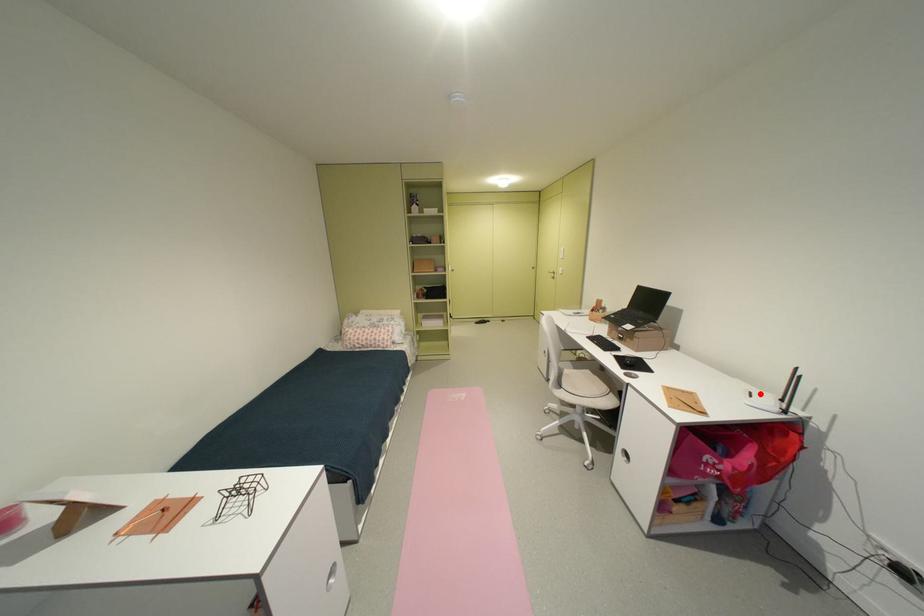
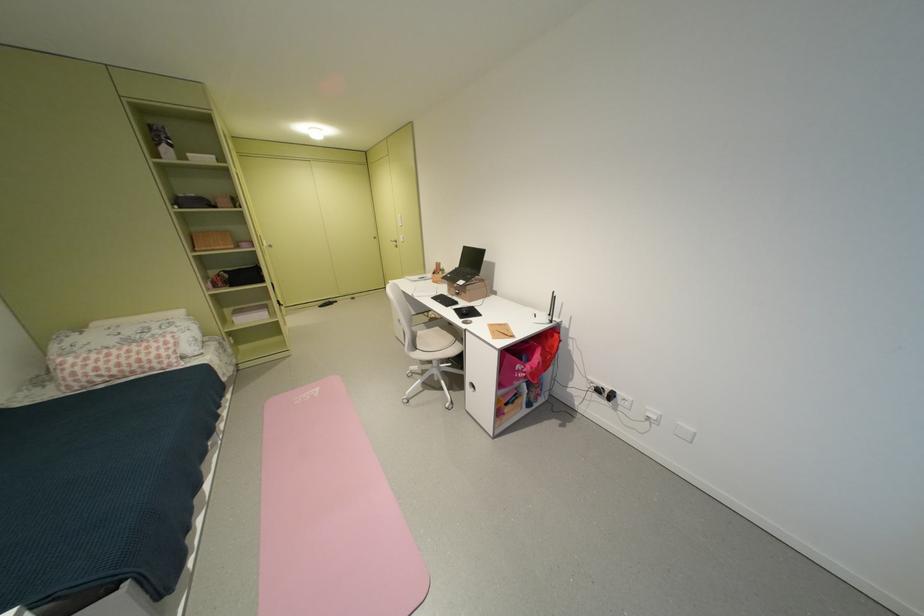
The point at the highlighted location is marked in the first image. Where is the corresponding point in the second image?

(544, 315)